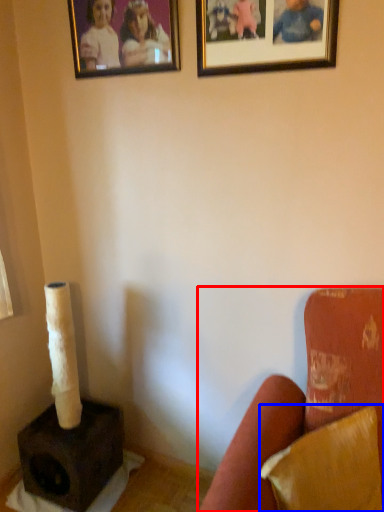
Question: Which object appears farthest to the camera in this image, furniture (highlighted by a red box) or pillow (highlighted by a blue box)?

Choices:
 (A) furniture
 (B) pillow

Answer: (B)